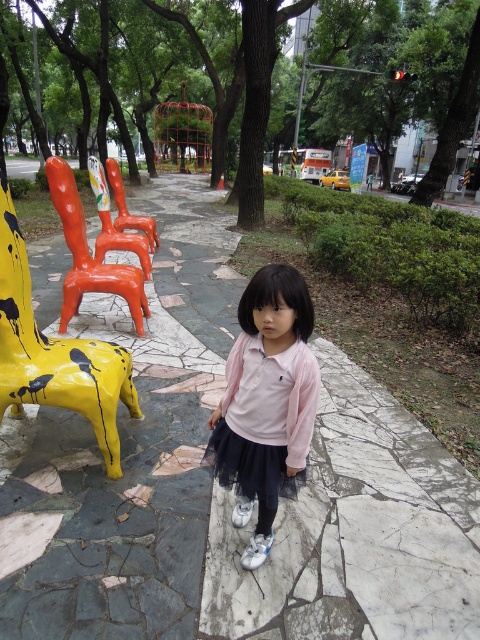
Who is higher up, pink satin shirt at center or orange glossy chair at center?

orange glossy chair at center is higher up.

Based on the photo, can you confirm if pink satin shirt at center is positioned below orange glossy chair at center?

Yes, pink satin shirt at center is below orange glossy chair at center.

Where is `pink satin shirt at center`? This screenshot has width=480, height=640. pink satin shirt at center is located at coordinates (265, 401).

Between white marble pavement at center and orange glossy chair at center, which one appears on the right side from the viewer's perspective?

Positioned to the right is white marble pavement at center.

Does white marble pavement at center have a smaller size compared to orange glossy chair at center?

Indeed, white marble pavement at center has a smaller size compared to orange glossy chair at center.

The height and width of the screenshot is (640, 480). What are the coordinates of `white marble pavement at center` in the screenshot? It's located at (225, 492).

Locate an element on the screen. The image size is (480, 640). white marble pavement at center is located at coordinates (225, 492).

Which is above, yellow painted plastic chair at left or orange glossy chair at center?

orange glossy chair at center

Between yellow painted plastic chair at left and orange glossy chair at center, which one has less height?

With less height is yellow painted plastic chair at left.

Is point (25, 301) positioned after point (140, 225)?

No, (25, 301) is in front of (140, 225).

Image resolution: width=480 pixels, height=640 pixels. I want to click on yellow painted plastic chair at left, so [x=55, y=353].